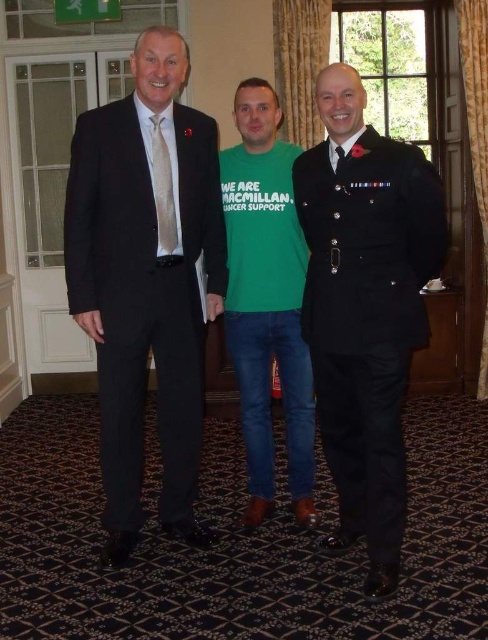
Question: Does black matte suit at left appear on the left side of green t-shirt at center?

Choices:
 (A) no
 (B) yes

Answer: (B)

Question: Is uniformed man at center to the right of green t-shirt at center from the viewer's perspective?

Choices:
 (A) yes
 (B) no

Answer: (A)

Question: Which point is farther to the camera?

Choices:
 (A) black matte suit at left
 (B) uniformed man at center

Answer: (A)

Question: Considering the real-world distances, which object is farthest from the black matte suit at left?

Choices:
 (A) uniformed man at center
 (B) green t-shirt at center

Answer: (A)

Question: Among these points, which one is nearest to the camera?

Choices:
 (A) (351, 397)
 (B) (303, 426)
 (C) (66, 218)

Answer: (C)

Question: Does black matte suit at left have a smaller size compared to green t-shirt at center?

Choices:
 (A) no
 (B) yes

Answer: (A)